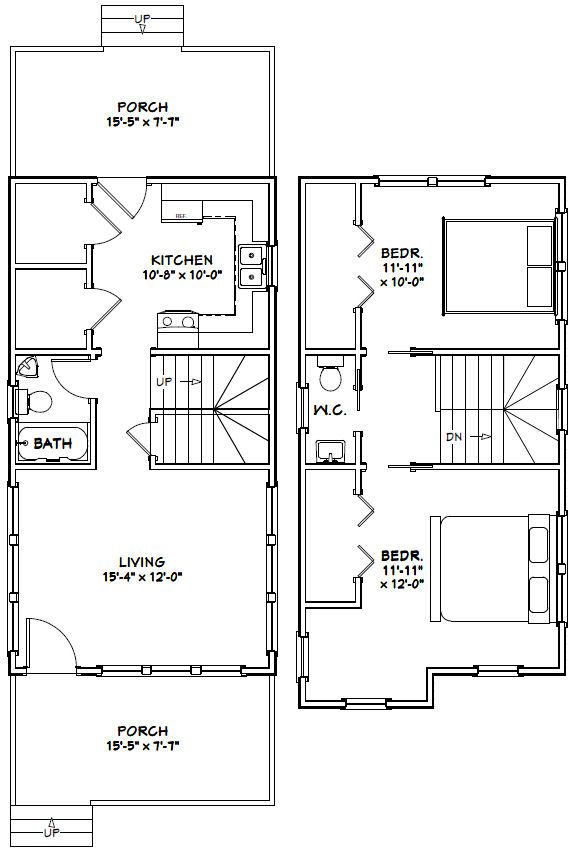
Find the location of a particular element. drawn pillows in blueprint is located at coordinates (534, 251), (545, 282), (532, 550), (536, 602).